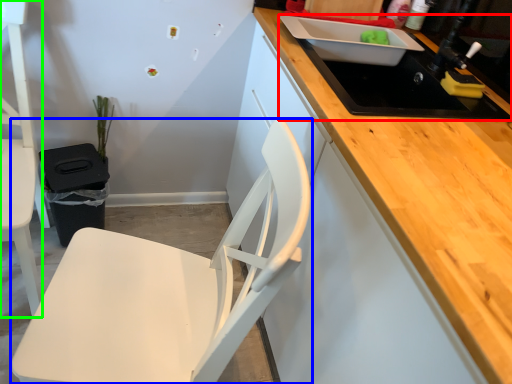
Question: Which object is positioned farthest from sink (highlighted by a red box)? Select from chair (highlighted by a blue box) and chair (highlighted by a green box).

Choices:
 (A) chair
 (B) chair

Answer: (B)